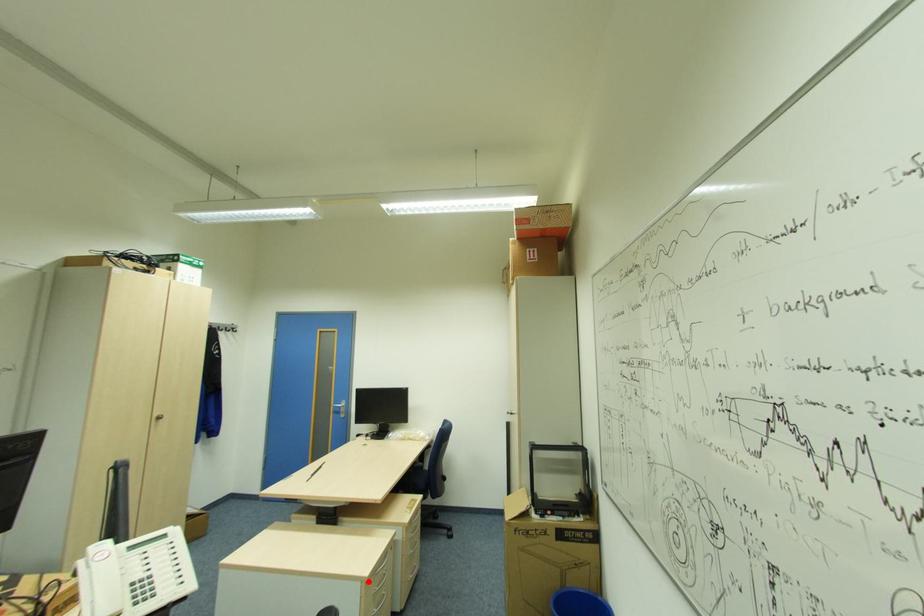
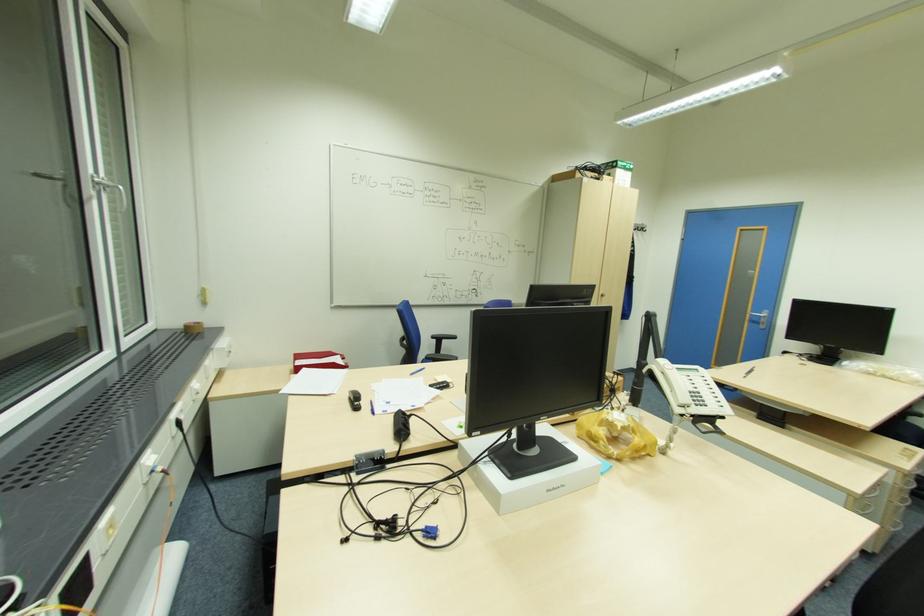
Where in the second image is the point corresponding to the highlighted location from the first image?

(857, 498)